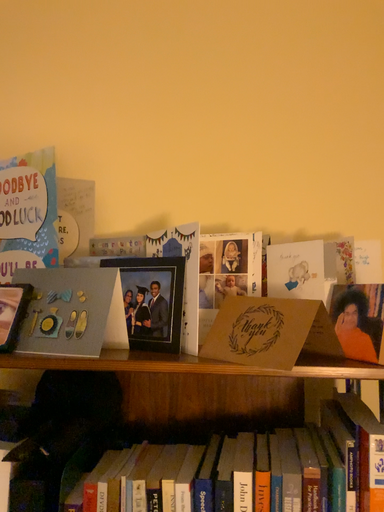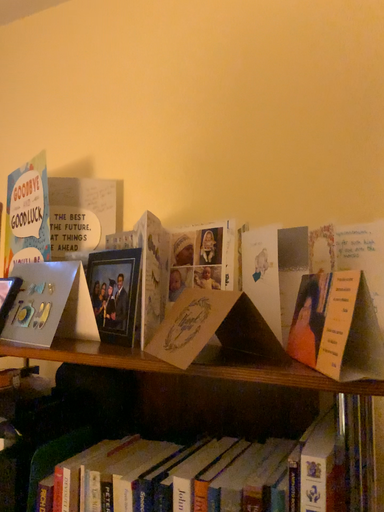
Question: How did the camera likely rotate when shooting the video?

Choices:
 (A) rotated right
 (B) rotated left

Answer: (B)